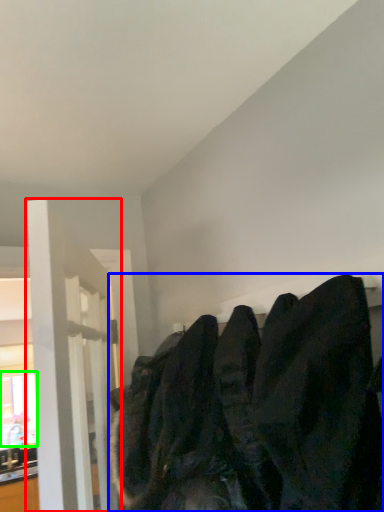
Question: Based on their relative distances, which object is nearer to door (highlighted by a red box)? Choose from sweatshirt (highlighted by a blue box) and window (highlighted by a green box).

Choices:
 (A) sweatshirt
 (B) window

Answer: (A)